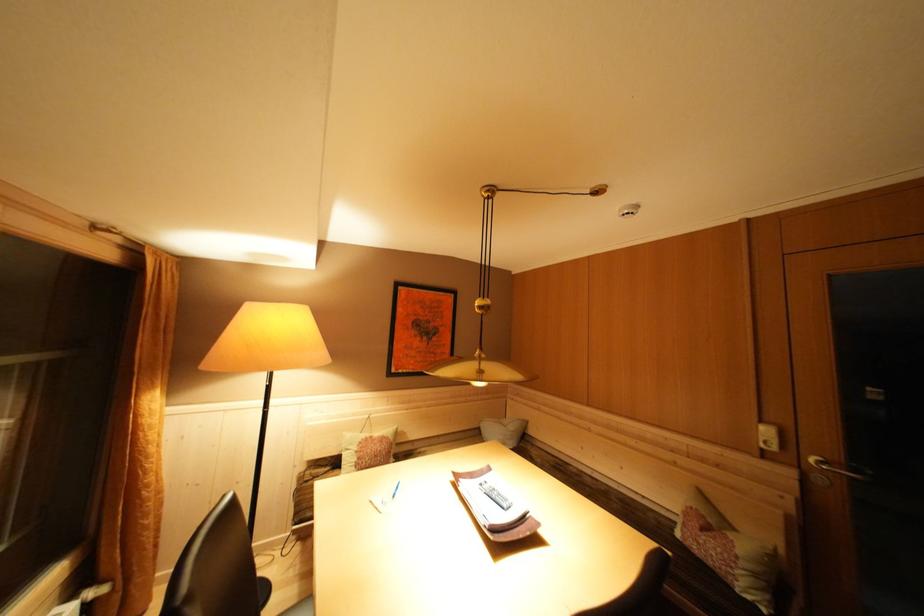
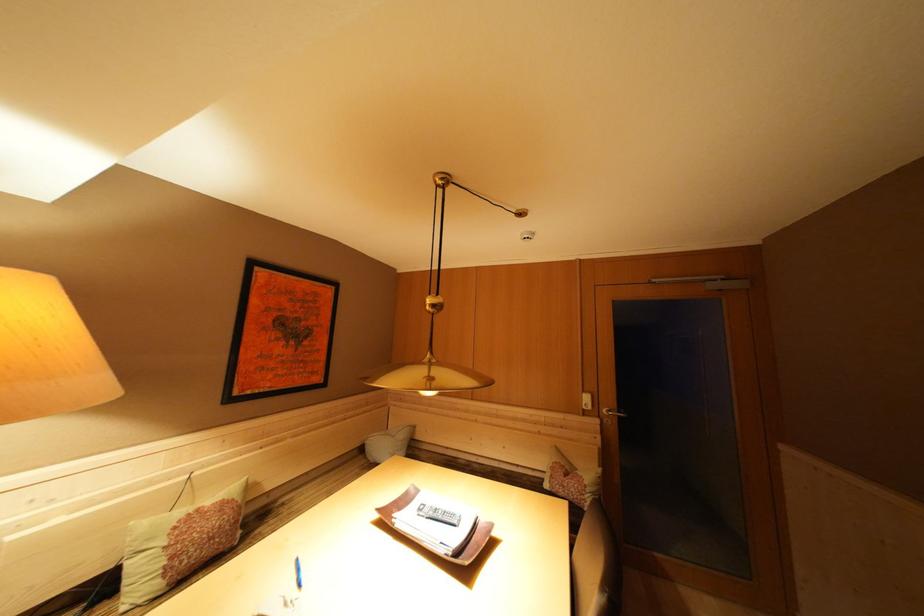
Locate, in the second image, the point that corresponds to the point at 487,363 in the first image.

(438, 369)